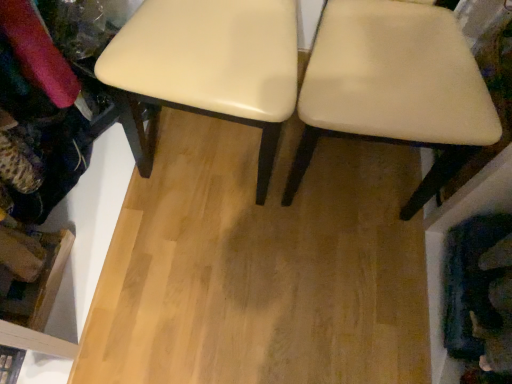
Question: Considering the positions of point (295, 160) and point (151, 41), is point (295, 160) closer or farther from the camera than point (151, 41)?

Choices:
 (A) farther
 (B) closer

Answer: (A)

Question: Looking at the image, does beige fabric chair at center seem bigger or smaller compared to matte cream stool at center?

Choices:
 (A) small
 (B) big

Answer: (B)

Question: Is beige fabric chair at center spatially inside matte cream stool at center, or outside of it?

Choices:
 (A) outside
 (B) inside

Answer: (A)

Question: From the image's perspective, is matte cream stool at center above or below beige fabric chair at center?

Choices:
 (A) above
 (B) below

Answer: (A)

Question: In the image, is matte cream stool at center positioned in front of or behind beige fabric chair at center?

Choices:
 (A) behind
 (B) front

Answer: (A)

Question: In terms of width, does matte cream stool at center look wider or thinner when compared to beige fabric chair at center?

Choices:
 (A) thin
 (B) wide

Answer: (B)

Question: From a real-world perspective, relative to beige fabric chair at center, is matte cream stool at center vertically above or below?

Choices:
 (A) below
 (B) above

Answer: (A)